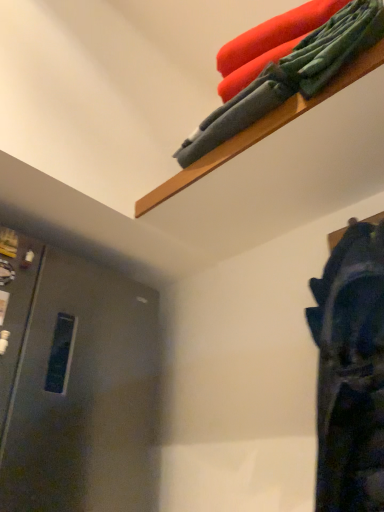
This screenshot has height=512, width=384. What do you see at coordinates (260, 130) in the screenshot?
I see `wooden shelf at upper right` at bounding box center [260, 130].

Measure the distance between point (197, 179) and camera.

Point (197, 179) is 3.34 feet away from camera.

Measure the distance between wooden shelf at upper right and camera.

They are 28.70 inches apart.

Locate an element on the screen. wooden shelf at upper right is located at coordinates (260, 130).

What are the coordinates of `wooden shelf at upper right` in the screenshot? It's located at (260, 130).